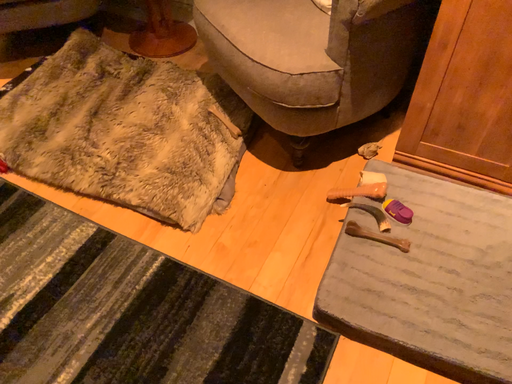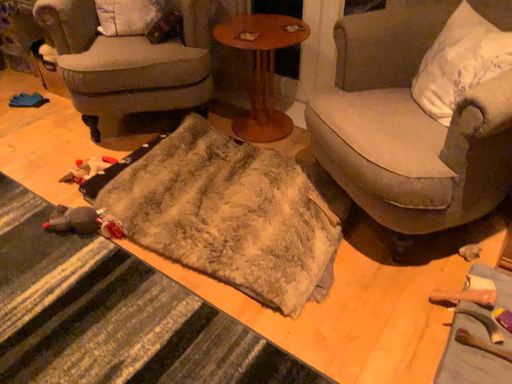
Question: Which way did the camera rotate in the video?

Choices:
 (A) rotated downward
 (B) rotated upward

Answer: (B)